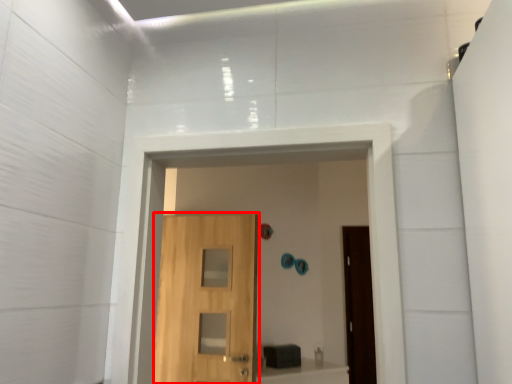
Question: From the image's perspective, what is the correct spatial positioning of door (annotated by the red box) in reference to passage?

Choices:
 (A) above
 (B) below

Answer: (B)